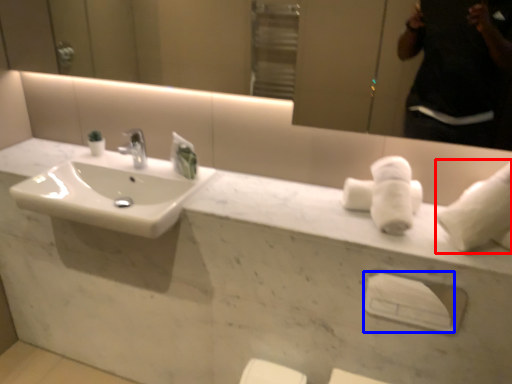
Question: Among these objects, which one is nearest to the camera, bath towel (highlighted by a red box) or towel bar (highlighted by a blue box)?

Choices:
 (A) bath towel
 (B) towel bar

Answer: (A)